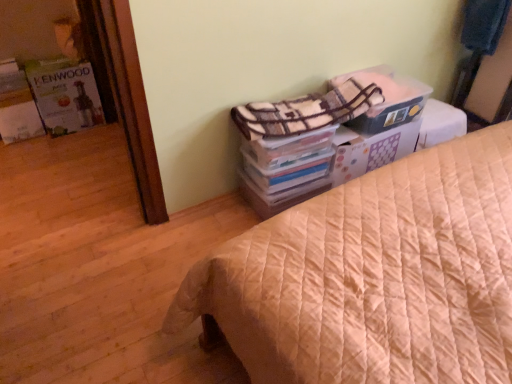
Question: In terms of width, does white cardboard box at upper right look wider or thinner when compared to plaid fabric blanket at upper right, positioned as the 1th blanket in top-to-bottom order?

Choices:
 (A) wide
 (B) thin

Answer: (A)

Question: Would you say white cardboard box at upper right is to the left or to the right of plaid fabric blanket at upper right, acting as the second blanket starting from the bottom, in the picture?

Choices:
 (A) left
 (B) right

Answer: (A)

Question: Based on their relative distances, which object is farther from the beige quilted bed at center?

Choices:
 (A) plaid fabric blanket at upper right, marked as the 1th blanket in a left-to-right arrangement
 (B) matte white kenwood appliance at left
 (C) plaid fabric blanket at upper right, acting as the second blanket starting from the bottom
 (D) white cardboard box at upper right

Answer: (B)

Question: Which is farther from the beige quilted bed at center?

Choices:
 (A) plaid fabric blanket at upper right, which is the 2th blanket in front-to-back order
 (B) matte white kenwood appliance at left
 (C) plaid fabric blanket at upper right, which ranks as the 2th blanket in top-to-bottom order
 (D) white cardboard box at upper right

Answer: (B)